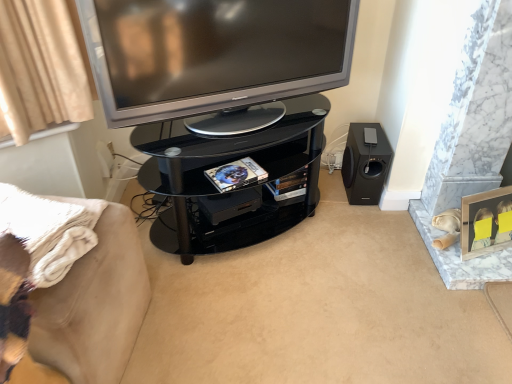
Identify the location of free space above black matte speaker at lower right (from a real-world perspective). The image size is (512, 384). point(370,130).